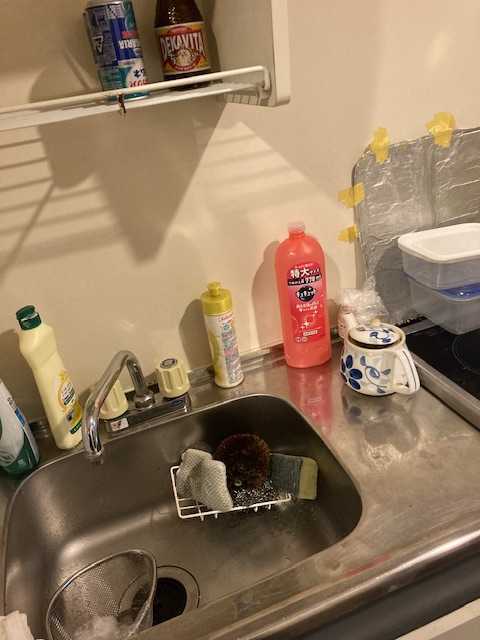
Where is `wall`? The width and height of the screenshot is (480, 640). wall is located at coordinates (126, 205).